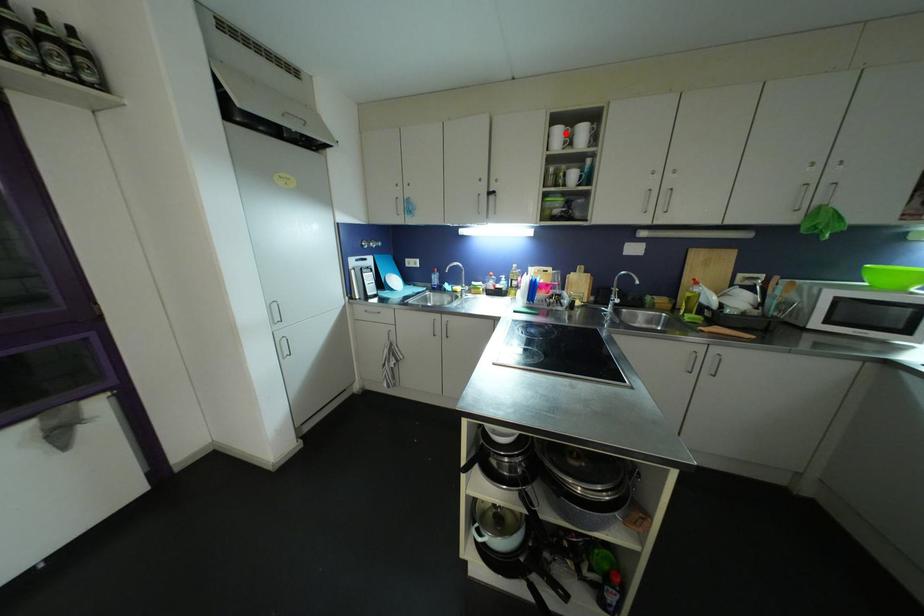
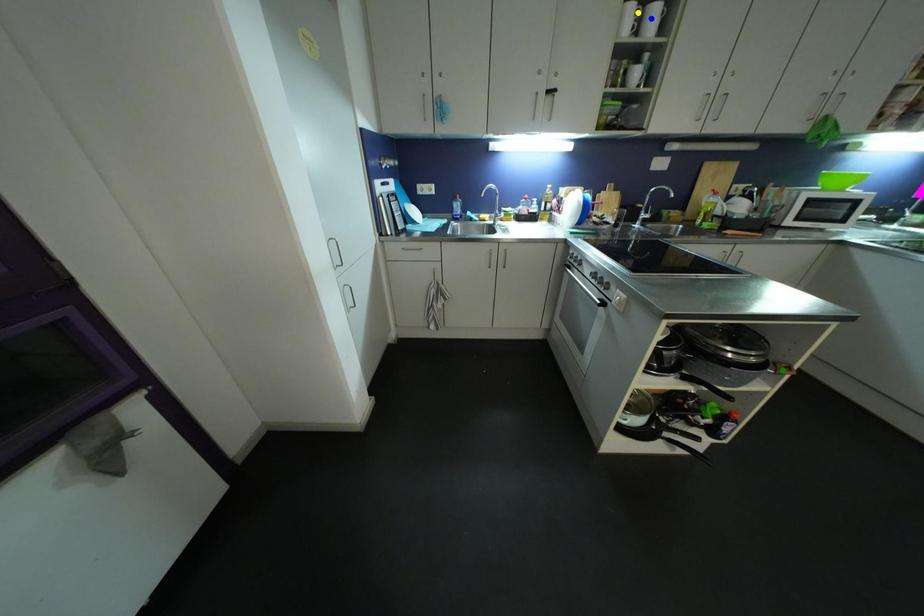
Question: I am providing you with two images of the same scene from different viewpoints. A red point is marked on the first image. You are given multiple points on the second image. Which point in image 2 is actually the same real-world point as the red point in image 1?

Choices:
 (A) green point
 (B) yellow point
 (C) blue point

Answer: (B)